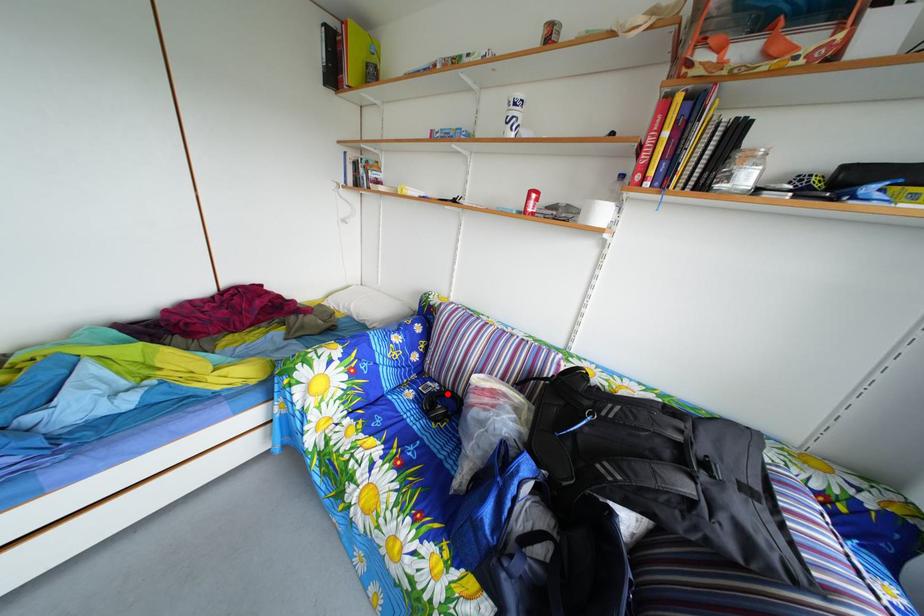
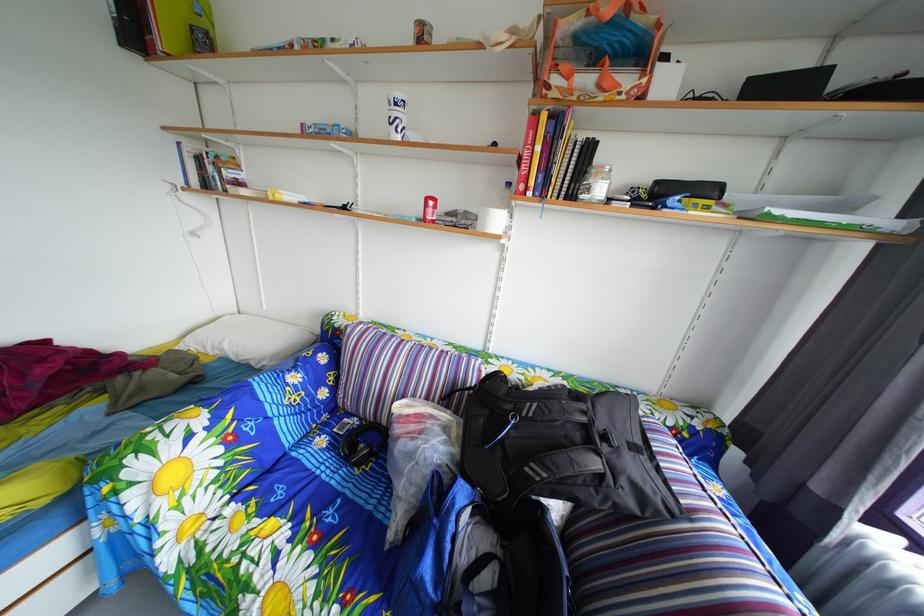
Locate, in the second image, the point that corresponds to the highlighted location in the first image.

(367, 428)